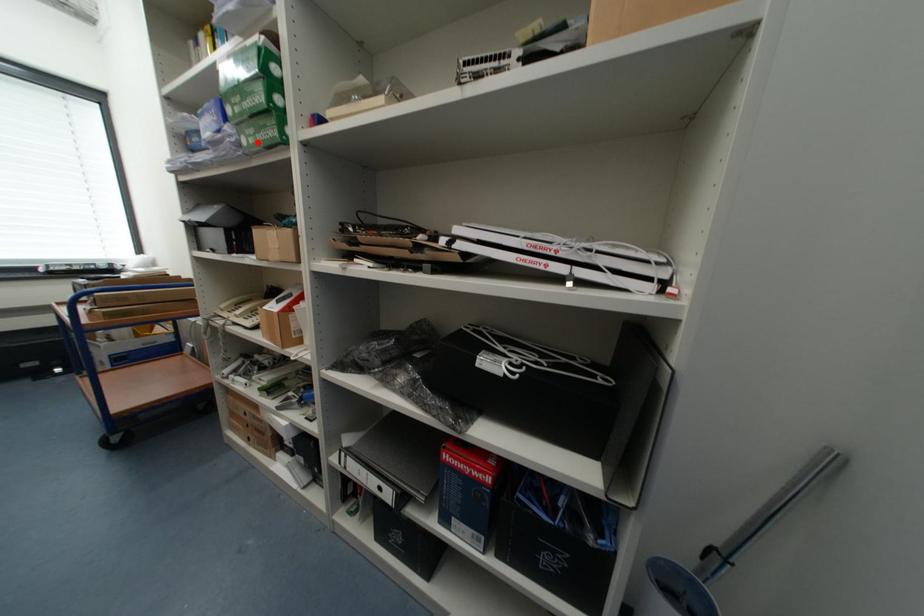
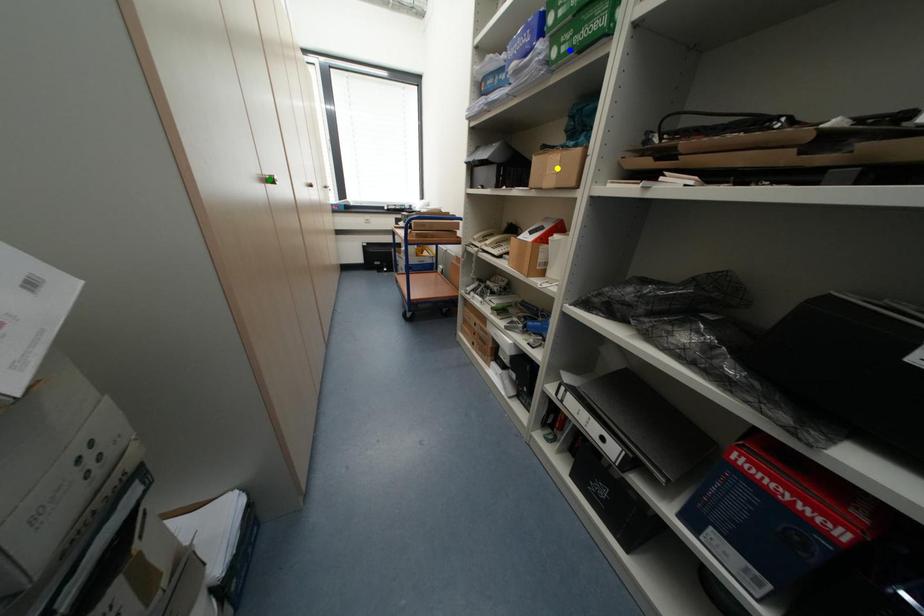
Question: I am providing you with two images of the same scene from different viewpoints. A red point is marked on the first image. You are given multiple points on the second image. Which point in image 2 represents the same 3d spot as the red point in image 1?

Choices:
 (A) blue point
 (B) yellow point
 (C) green point

Answer: (A)